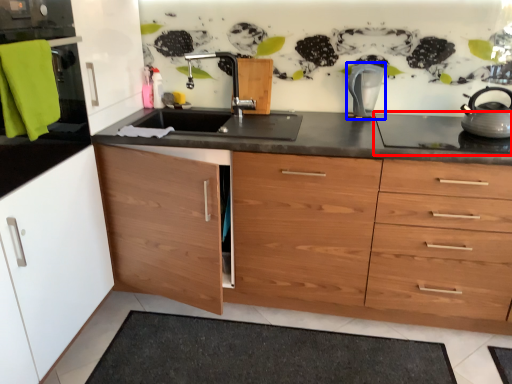
Question: Which of the following is the closest to the observer, gas stove (highlighted by a red box) or kitchen appliance (highlighted by a blue box)?

Choices:
 (A) gas stove
 (B) kitchen appliance

Answer: (A)